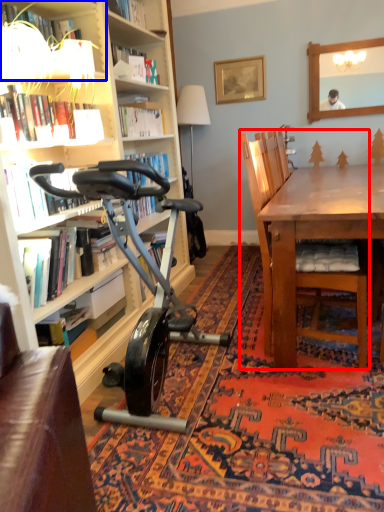
Question: Which object appears closest to the camera in this image, chair (highlighted by a red box) or shelf (highlighted by a blue box)?

Choices:
 (A) chair
 (B) shelf

Answer: (B)